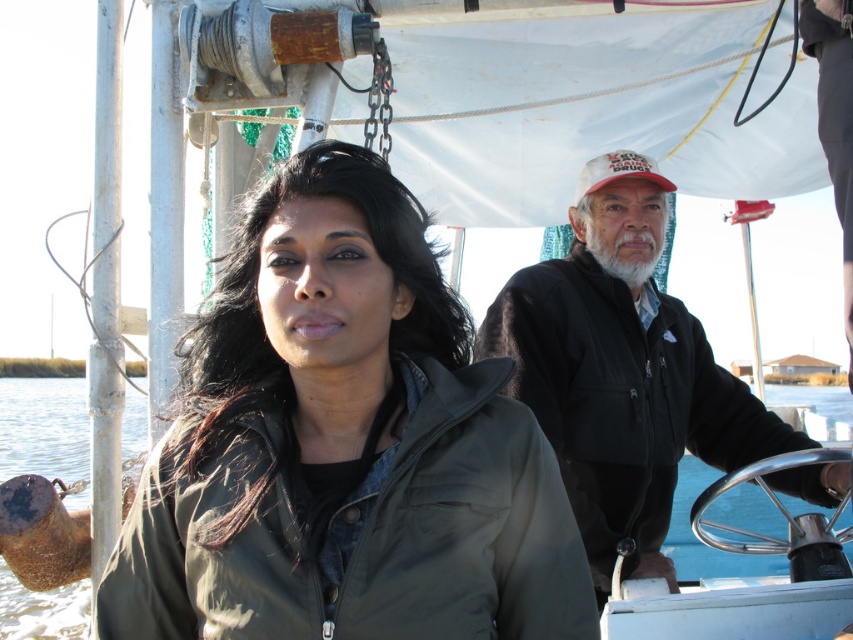
Between point (300, 257) and point (517, 296), which one is positioned in front?

Point (300, 257)

The width and height of the screenshot is (853, 640). I want to click on green matte jacket at center, so click(x=344, y=445).

Is point (532, 264) behind point (80, 628)?

No, it is not.

Is black fleece jacket at center wider than clear blue water at center?

No.

The width and height of the screenshot is (853, 640). Describe the element at coordinates (622, 371) in the screenshot. I see `black fleece jacket at center` at that location.

Where is `black fleece jacket at center`? This screenshot has height=640, width=853. black fleece jacket at center is located at coordinates (622, 371).

Consider the image. Can you confirm if green matte jacket at center is positioned to the right of clear blue water at center?

Yes, green matte jacket at center is to the right of clear blue water at center.

Who is more forward, (318, 483) or (0, 403)?

Point (318, 483) is more forward.

Where is `green matte jacket at center`? The width and height of the screenshot is (853, 640). green matte jacket at center is located at coordinates tap(344, 445).